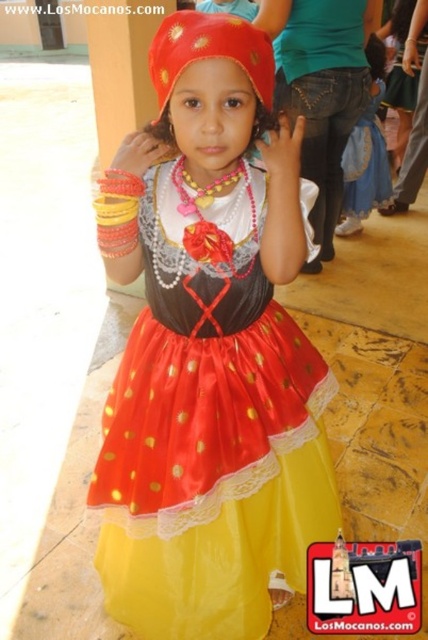
Is shiny satin dress at center bigger than matte satin headscarf at center?

Correct, shiny satin dress at center is larger in size than matte satin headscarf at center.

Is shiny satin dress at center above matte satin headscarf at center?

No.

Locate an element on the screen. The image size is (428, 640). shiny satin dress at center is located at coordinates (210, 442).

The image size is (428, 640). Identify the location of shiny satin dress at center. click(x=210, y=442).